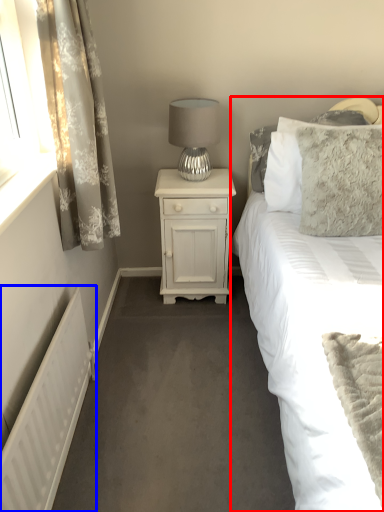
Question: Which object is closer to the camera taking this photo, bed (highlighted by a red box) or radiator (highlighted by a blue box)?

Choices:
 (A) bed
 (B) radiator

Answer: (A)